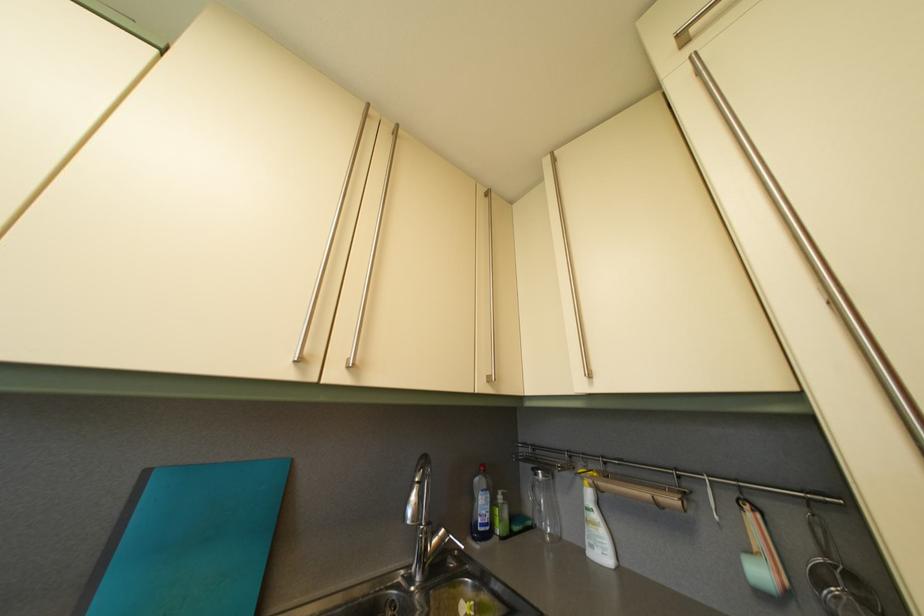
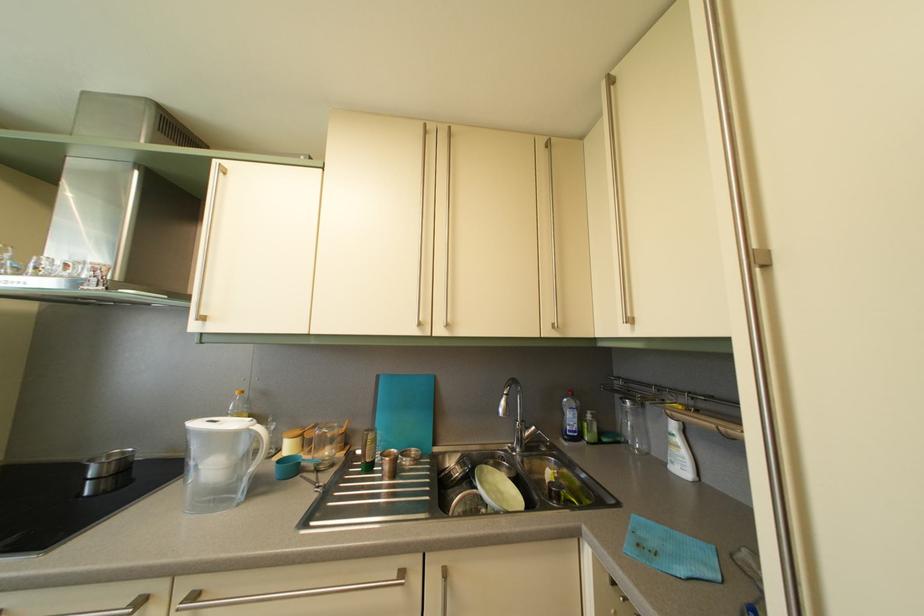
Locate, in the second image, the point that corresponds to the point at 603,524 in the first image.

(687, 448)